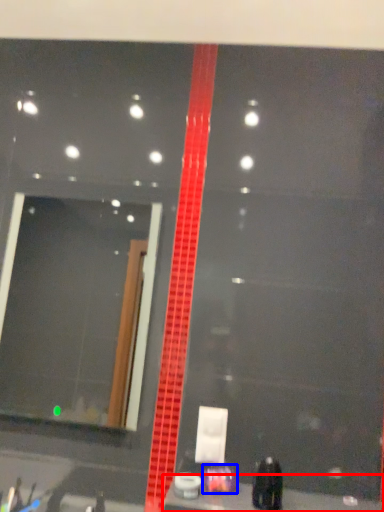
Question: Which of the following is the closest to the observer, counter top (highlighted by a red box) or toiletry (highlighted by a blue box)?

Choices:
 (A) counter top
 (B) toiletry

Answer: (A)